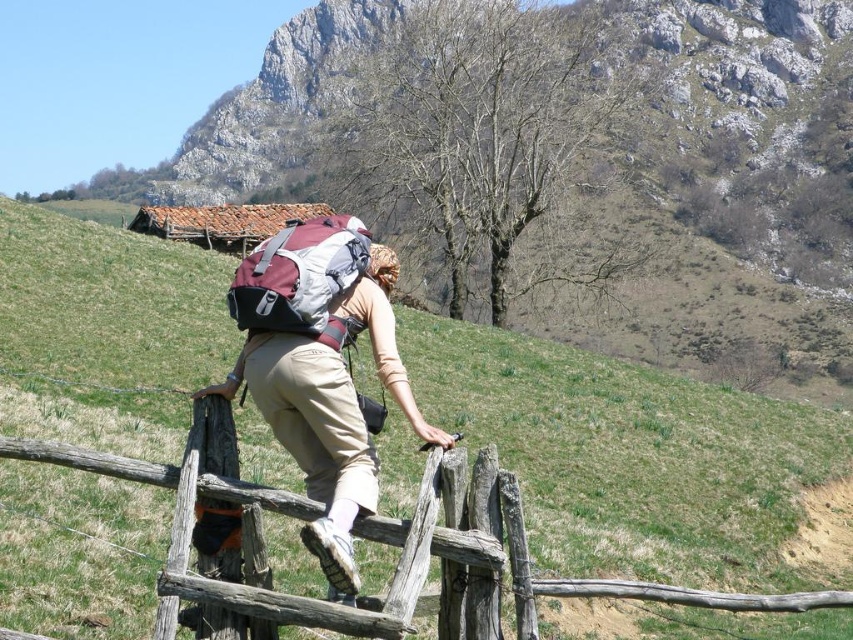
Question: Can you confirm if green grassy at center is positioned to the right of matte gray backpack at center?

Choices:
 (A) no
 (B) yes

Answer: (B)

Question: Is green grassy at center further to the viewer compared to weathered wood fence at center?

Choices:
 (A) no
 (B) yes

Answer: (B)

Question: Which point appears farthest from the camera in this image?

Choices:
 (A) (229, 604)
 (B) (550, 515)
 (C) (270, 424)

Answer: (B)

Question: Does green grassy at center have a smaller size compared to matte gray backpack at center?

Choices:
 (A) no
 (B) yes

Answer: (A)

Question: Estimate the real-world distances between objects in this image. Which object is closer to the matte gray backpack at center?

Choices:
 (A) weathered wood fence at center
 (B) green grassy at center

Answer: (A)

Question: Which point is farther to the camera?

Choices:
 (A) matte gray backpack at center
 (B) weathered wood fence at center
 (C) green grassy at center

Answer: (C)